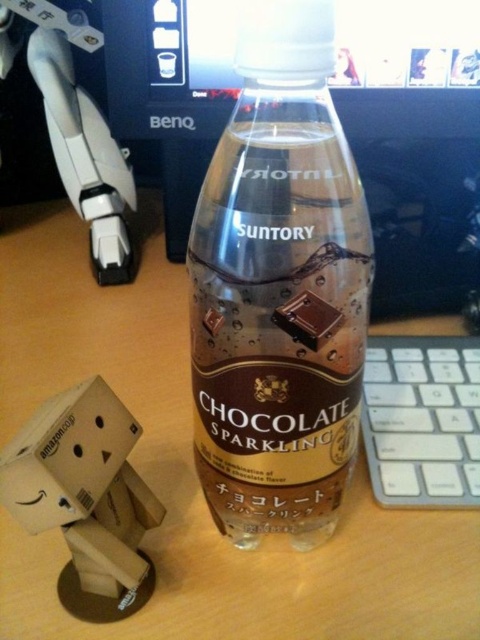
Between brown matte plastic bottle at center and white plastic keyboard at right, which one is positioned lower?

white plastic keyboard at right is lower down.

Does brown matte plastic bottle at center appear on the left side of white plastic keyboard at right?

Yes, brown matte plastic bottle at center is to the left of white plastic keyboard at right.

This screenshot has width=480, height=640. Identify the location of brown matte plastic bottle at center. (277, 288).

Where is `brown matte plastic bottle at center`? brown matte plastic bottle at center is located at coordinates (277, 288).

Who is lower down, wooden figure at lower left or chocolate matte at bottle center?

wooden figure at lower left

Who is higher up, wooden figure at lower left or chocolate matte at bottle center?

chocolate matte at bottle center

What do you see at coordinates (194, 472) in the screenshot? The image size is (480, 640). I see `wooden figure at lower left` at bounding box center [194, 472].

Find the location of a particular element. This screenshot has width=480, height=640. wooden figure at lower left is located at coordinates tap(194, 472).

Who is higher up, wooden figure at lower left or cardboard box at lower left?

wooden figure at lower left is higher up.

Which is behind, point (8, 531) or point (75, 394)?

Point (8, 531)

The height and width of the screenshot is (640, 480). In order to click on wooden figure at lower left in this screenshot , I will do `click(194, 472)`.